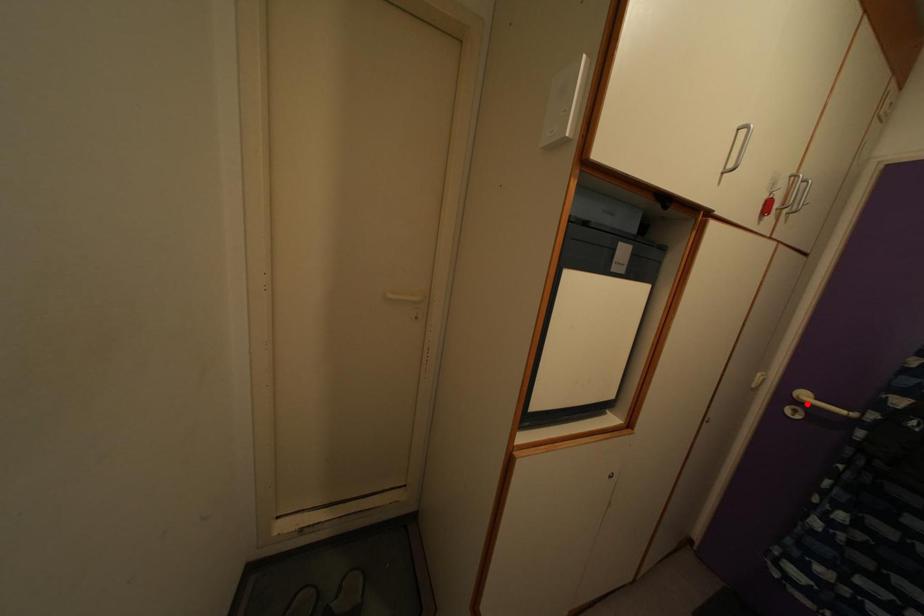
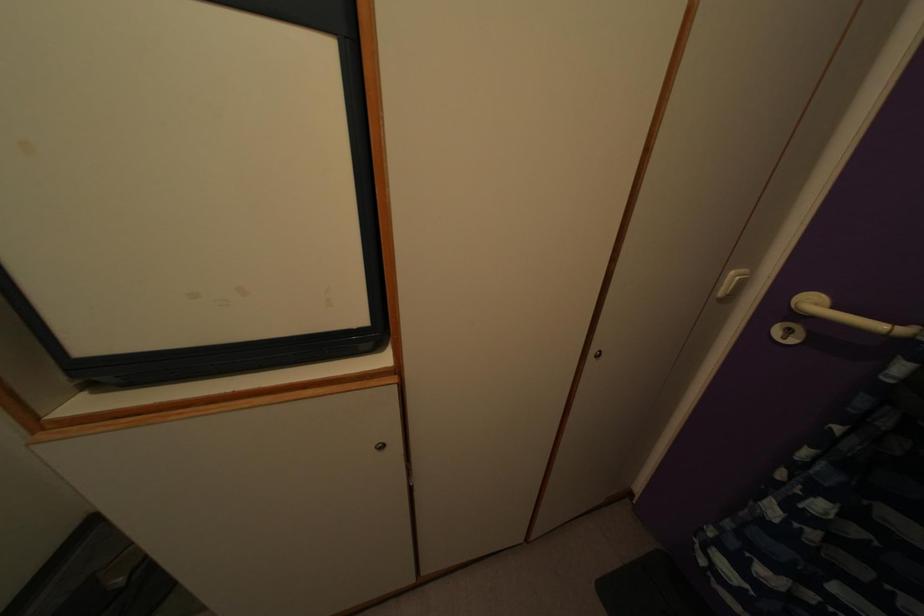
In the second image, find the point that corresponds to the highlighted location in the first image.

(815, 310)